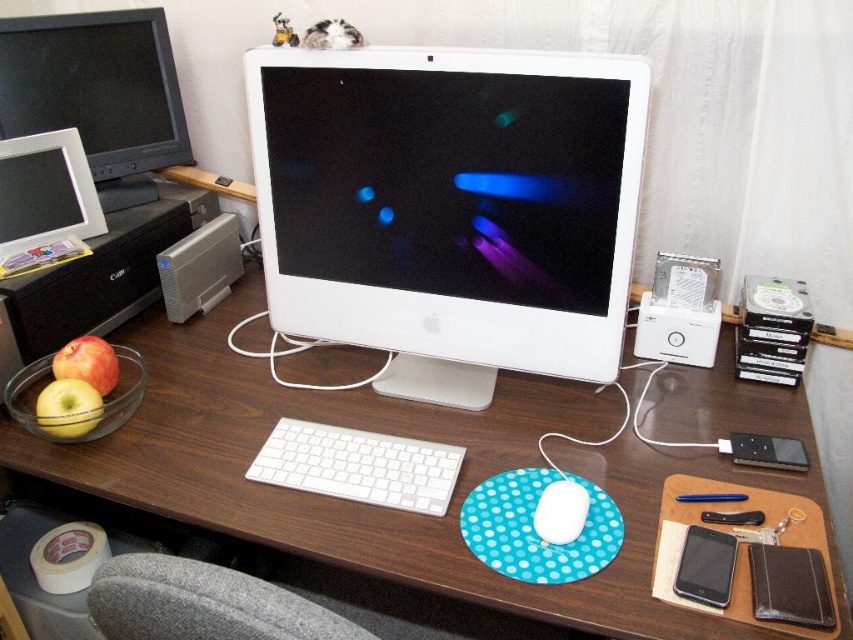
Question: Does white matte keyboard at center have a lesser width compared to white plastic ipod at right?

Choices:
 (A) yes
 (B) no

Answer: (B)

Question: Considering the real-world distances, which object is closest to the blue polka dot mousepad at center?

Choices:
 (A) white matte keyboard at center
 (B) white matte mouse at center
 (C) white plastic ipod at right

Answer: (B)

Question: Which point is closer to the camera?

Choices:
 (A) (149, 51)
 (B) (592, 301)
 (C) (97, 344)

Answer: (B)

Question: Can you confirm if white glossy computer monitor at center is positioned to the left of white plastic ipod at right?

Choices:
 (A) yes
 (B) no

Answer: (A)

Question: Among these objects, which one is farthest from the camera?

Choices:
 (A) white matte keyboard at center
 (B) matte black monitor at upper left
 (C) green matte apple at left

Answer: (B)

Question: Is white plastic ipod at right below white matte mouse at center?

Choices:
 (A) yes
 (B) no

Answer: (B)